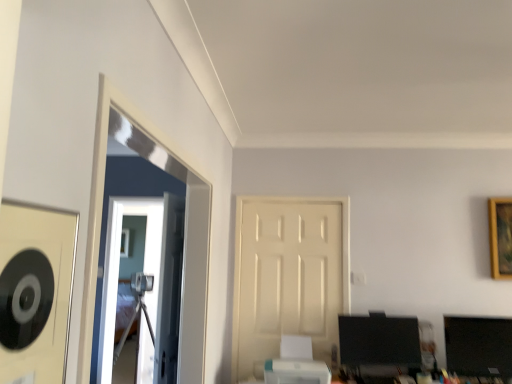
Locate an element on the screen. white matte door at center is located at coordinates (288, 277).

Measure the distance between point (351, 342) and camera.

Point (351, 342) and camera are 2.86 meters apart.

This screenshot has width=512, height=384. Describe the element at coordinates (296, 364) in the screenshot. I see `white plastic printer at lower center` at that location.

Locate an element on the screen. The width and height of the screenshot is (512, 384). transparent glass door at center is located at coordinates (119, 270).

Is the surface of gold wooden picture frame at upper right in direct contact with white plastic printer at lower center?

There is a gap between gold wooden picture frame at upper right and white plastic printer at lower center.

Consider the image. From the image's perspective, is gold wooden picture frame at upper right on white plastic printer at lower center?

Yes, from the image's perspective, gold wooden picture frame at upper right is over white plastic printer at lower center.

Who is shorter, gold wooden picture frame at upper right or white plastic printer at lower center?

Standing shorter between the two is white plastic printer at lower center.

Is white plastic printer at lower center completely or partially inside gold wooden picture frame at upper right?

No, gold wooden picture frame at upper right does not contain white plastic printer at lower center.

In terms of height, does white matte door at center look taller or shorter compared to white plastic printer at lower center?

Clearly, white matte door at center is taller compared to white plastic printer at lower center.

Visually, is white matte door at center positioned to the left or to the right of white plastic printer at lower center?

In the image, white matte door at center appears on the right side of white plastic printer at lower center.

Considering the sizes of objects matte black monitor at lower right and transparent glass door at center in the image provided, who is shorter, matte black monitor at lower right or transparent glass door at center?

Standing shorter between the two is matte black monitor at lower right.

Based on the photo, is matte black monitor at lower right to the left of transparent glass door at center from the viewer's perspective?

Incorrect, matte black monitor at lower right is not on the left side of transparent glass door at center.

Is point (418, 337) closer or farther from the camera than point (116, 301)?

Point (418, 337).

Is the position of matte black monitor at lower right less distant than that of transparent glass door at center?

Yes, matte black monitor at lower right is closer to the viewer.

Considering the relative sizes of white plastic printer at lower center and transparent glass door at center in the image provided, is white plastic printer at lower center shorter than transparent glass door at center?

Correct, white plastic printer at lower center is not as tall as transparent glass door at center.

Which object is wider, white plastic printer at lower center or transparent glass door at center?

Wider between the two is white plastic printer at lower center.

What's the angular difference between white plastic printer at lower center and transparent glass door at center's facing directions?

1.99 degrees separate the facing orientations of white plastic printer at lower center and transparent glass door at center.

Is the surface of white plastic printer at lower center in direct contact with transparent glass door at center?

No, white plastic printer at lower center is not next to transparent glass door at center.

Which is behind, point (141, 331) or point (394, 328)?

The point (141, 331) is behind.

From a real-world perspective, is transparent glass door at center beneath matte black monitor at lower right?

Incorrect, from a real-world perspective, transparent glass door at center is higher than matte black monitor at lower right.

Can you confirm if transparent glass door at center is taller than matte black monitor at lower right?

Yes.

Locate an element on the screen. computer monitor below the transparent glass door at center (from a real-world perspective) is located at coordinates (378, 345).

Between gold wooden picture frame at upper right and matte black monitor at lower right, which one appears on the right side from the viewer's perspective?

gold wooden picture frame at upper right is more to the right.

Between gold wooden picture frame at upper right and matte black monitor at lower right, which one has smaller width?

gold wooden picture frame at upper right.

Can matte black monitor at lower right be found inside gold wooden picture frame at upper right?

No, matte black monitor at lower right is not inside gold wooden picture frame at upper right.

Is gold wooden picture frame at upper right bigger or smaller than matte black monitor at lower right?

In the image, gold wooden picture frame at upper right appears to be smaller than matte black monitor at lower right.

Can we say gold wooden picture frame at upper right lies outside white matte door at center?

Yes, gold wooden picture frame at upper right is located beyond the bounds of white matte door at center.

Is gold wooden picture frame at upper right wider or thinner than white matte door at center?

Considering their sizes, gold wooden picture frame at upper right looks broader than white matte door at center.

Locate an element on the screen. This screenshot has height=384, width=512. picture frame on the right of white matte door at center is located at coordinates [x=500, y=237].

Considering the sizes of gold wooden picture frame at upper right and white matte door at center in the image, is gold wooden picture frame at upper right taller or shorter than white matte door at center?

gold wooden picture frame at upper right is shorter than white matte door at center.

Locate an element on the screen. This screenshot has height=384, width=512. picture frame behind the white plastic printer at lower center is located at coordinates (500, 237).

Where is `door on the right of white plastic printer at lower center`? This screenshot has height=384, width=512. door on the right of white plastic printer at lower center is located at coordinates (288, 277).

Based on their spatial positions, is white plastic printer at lower center or matte black monitor at lower right further from transparent glass door at center?

matte black monitor at lower right is further to transparent glass door at center.

Looking at this image, considering their positions, is gold wooden picture frame at upper right positioned further to white matte door at center than matte black monitor at lower right?

gold wooden picture frame at upper right is further to white matte door at center.

From the image, which object appears to be farther from matte black monitor at lower right, white matte door at center or gold wooden picture frame at upper right?

gold wooden picture frame at upper right is further to matte black monitor at lower right.

Which object lies nearer to the anchor point gold wooden picture frame at upper right, transparent glass door at center or white matte door at center?

Among the two, white matte door at center is located nearer to gold wooden picture frame at upper right.

Based on the photo, looking at the image, which one is located further to gold wooden picture frame at upper right, matte black monitor at lower right or white matte door at center?

Among the two, white matte door at center is located further to gold wooden picture frame at upper right.

In the scene shown: When comparing their distances from gold wooden picture frame at upper right, does white matte door at center or white plastic printer at lower center seem further?

white plastic printer at lower center.

Consider the image. From the image, which object appears to be farther from transparent glass door at center, white plastic printer at lower center or gold wooden picture frame at upper right?

gold wooden picture frame at upper right is positioned further to the anchor transparent glass door at center.

Considering their positions, is gold wooden picture frame at upper right positioned closer to transparent glass door at center than white plastic printer at lower center?

white plastic printer at lower center is closer to transparent glass door at center.

The image size is (512, 384). Find the location of `computer monitor between transparent glass door at center and gold wooden picture frame at upper right in the horizontal direction`. computer monitor between transparent glass door at center and gold wooden picture frame at upper right in the horizontal direction is located at coordinates (378, 345).

Locate an element on the screen. The image size is (512, 384). printer between transparent glass door at center and gold wooden picture frame at upper right is located at coordinates (296, 364).

In order to click on door located between white plastic printer at lower center and gold wooden picture frame at upper right in the left-right direction in this screenshot , I will do `click(288, 277)`.

Where is `printer situated between transparent glass door at center and white matte door at center from left to right`? The image size is (512, 384). printer situated between transparent glass door at center and white matte door at center from left to right is located at coordinates [x=296, y=364].